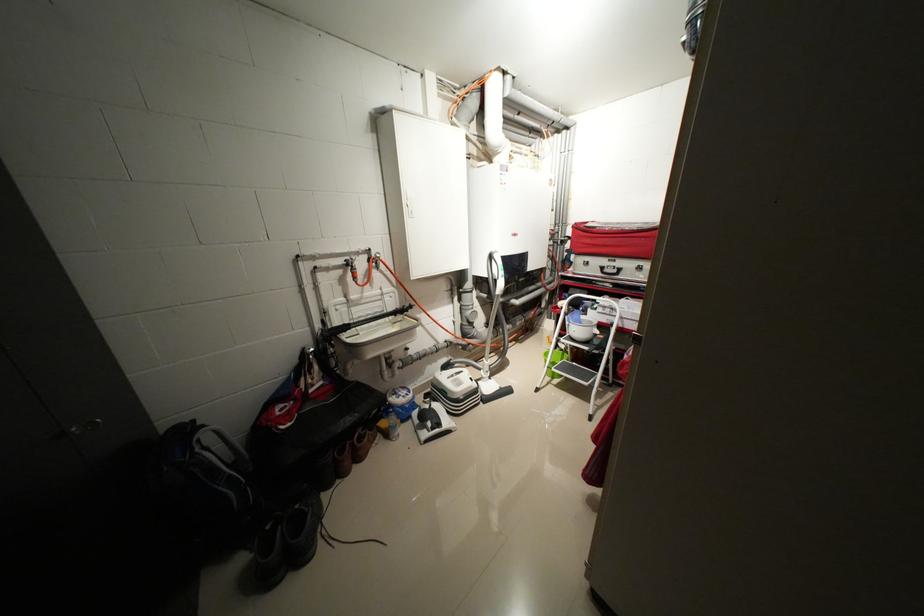
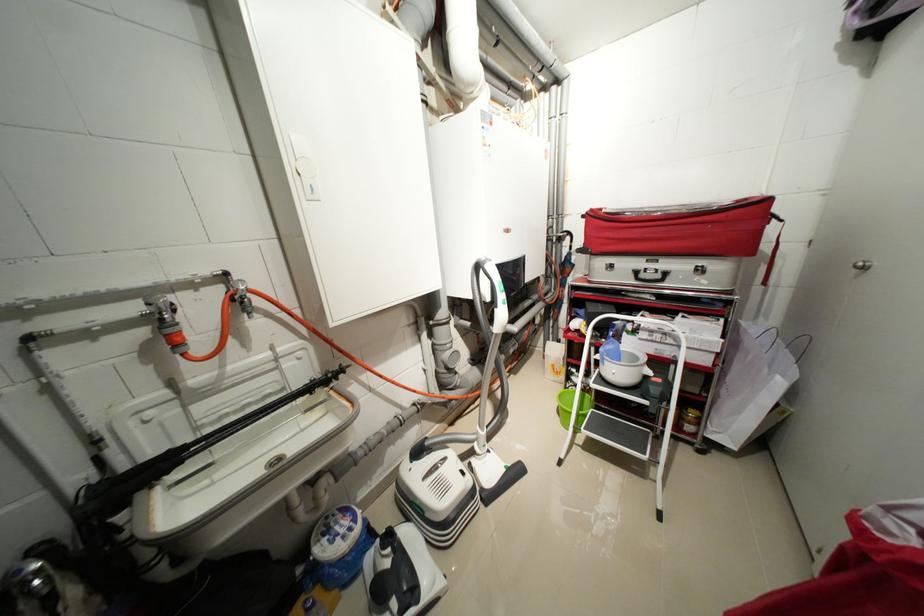
Question: The images are taken continuously from a first-person perspective. In which direction are you moving?

Choices:
 (A) Left
 (B) Right
 (C) Forward
 (D) Backward

Answer: (C)